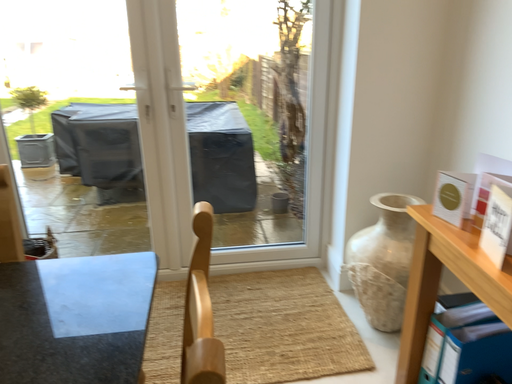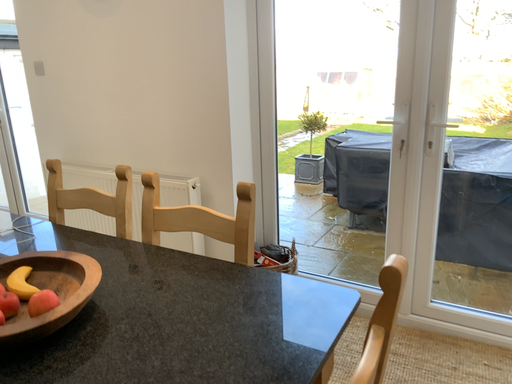
Question: Which way did the camera rotate in the video?

Choices:
 (A) rotated upward
 (B) rotated downward

Answer: (A)